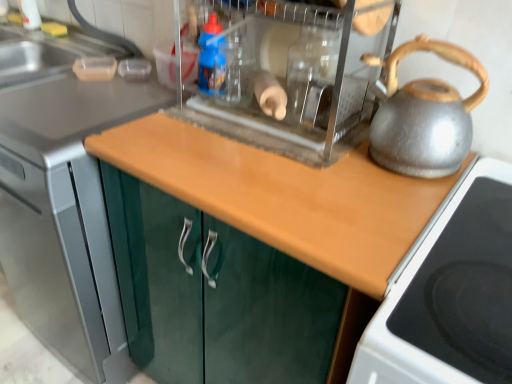
Identify the location of vacant region above wooden at center, which is the 2th countertop in right-to-left order (from a real-world perspective). This screenshot has height=384, width=512. (78, 99).